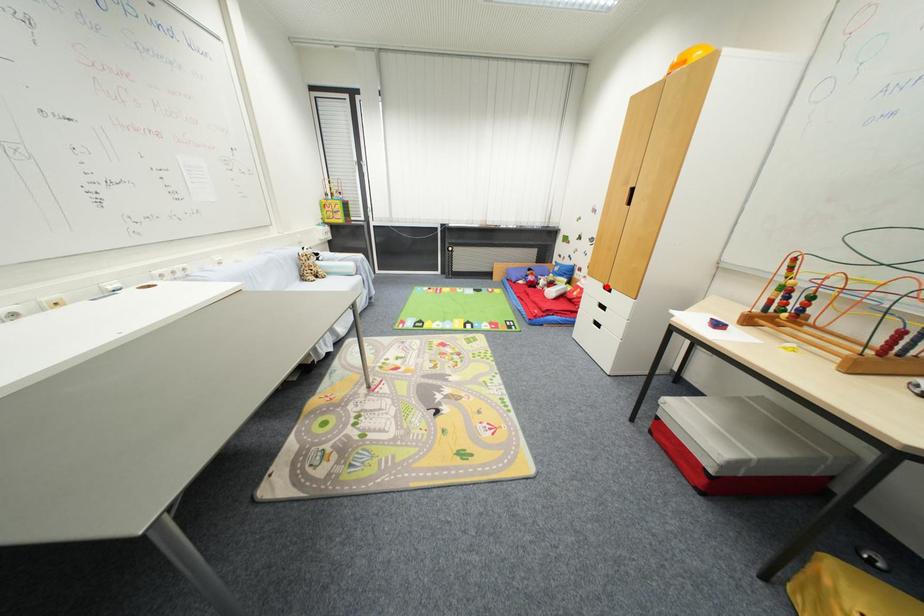
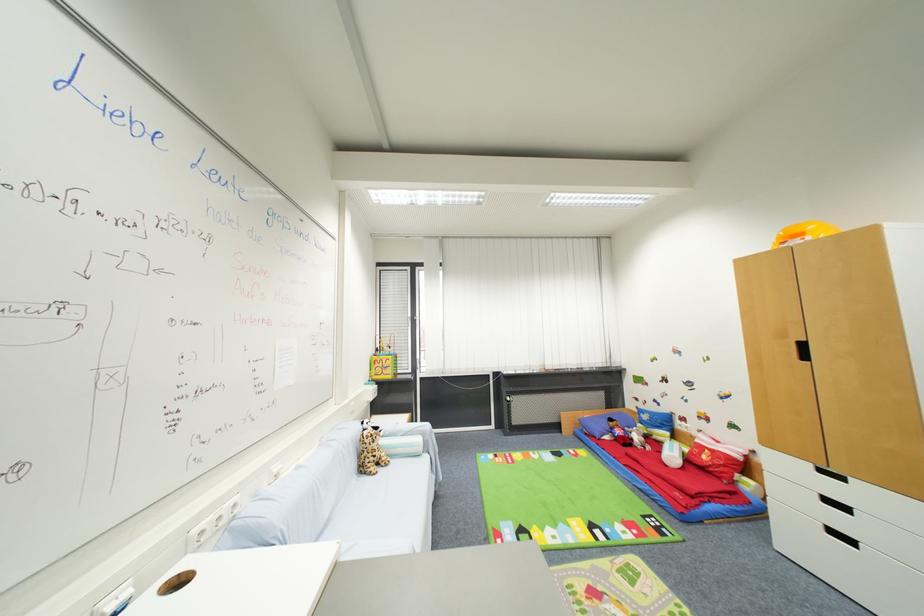
Locate, in the second image, the point that corresponds to the highlighted location in the first image.

(816, 467)